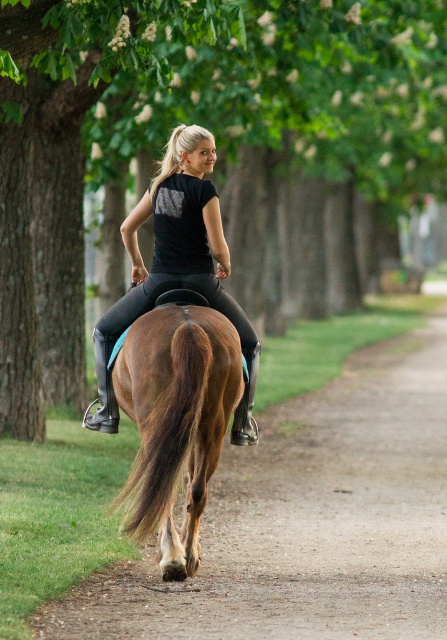
Question: From the image, what is the correct spatial relationship of brown leather horse at center in relation to black matte riding pants at center?

Choices:
 (A) left
 (B) right

Answer: (B)

Question: Which point is farther from the camera taking this photo?

Choices:
 (A) (272, 100)
 (B) (209, 454)
 (C) (181, 280)

Answer: (A)

Question: Estimate the real-world distances between objects in this image. Which object is closer to the brown glossy horse at center?

Choices:
 (A) green leafy tree at center
 (B) brown leather horse at center

Answer: (B)

Question: Is brown leather horse at center bigger than black matte riding pants at center?

Choices:
 (A) yes
 (B) no

Answer: (A)

Question: Estimate the real-world distances between objects in this image. Which object is closer to the black matte riding pants at center?

Choices:
 (A) brown glossy horse at center
 (B) brown leather horse at center
 (C) green leafy tree at center

Answer: (A)

Question: Where is brown leather horse at center located in relation to black matte riding pants at center in the image?

Choices:
 (A) left
 (B) right

Answer: (B)